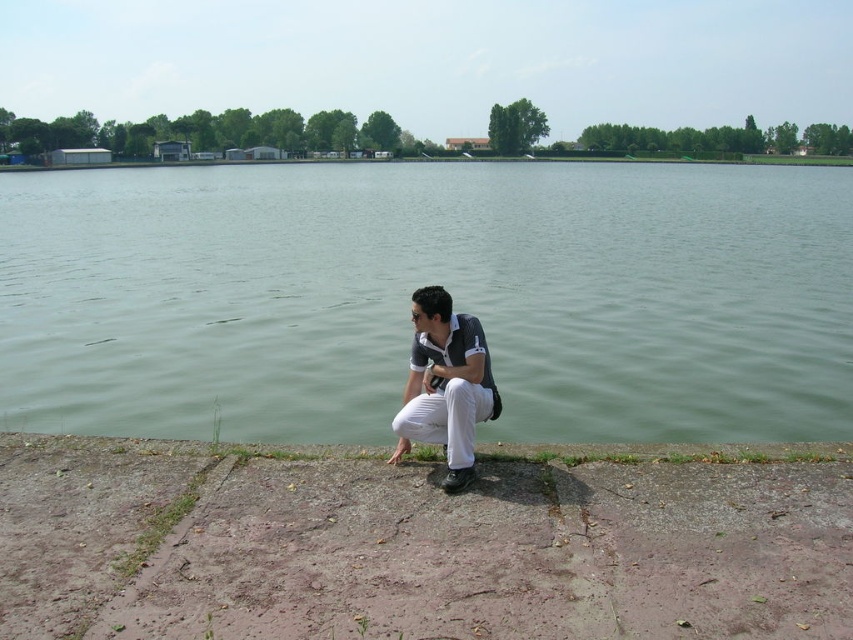
Is green water at lower center bigger than white cotton pants at lower center?

Yes.

Is point (115, 392) farther from camera compared to point (440, 483)?

Yes.

In order to click on green water at lower center in this screenshot , I will do `click(425, 284)`.

Is white cotton pants at lower center bigger than gray concrete curb at lower center?

Correct, white cotton pants at lower center is larger in size than gray concrete curb at lower center.

Is the position of white cotton pants at lower center less distant than that of gray concrete curb at lower center?

Yes, it is.

Where is `white cotton pants at lower center`? This screenshot has width=853, height=640. white cotton pants at lower center is located at coordinates (445, 385).

Can you confirm if green water at lower center is taller than gray concrete curb at lower center?

Yes.

Does green water at lower center appear on the right side of gray concrete curb at lower center?

Correct, you'll find green water at lower center to the right of gray concrete curb at lower center.

Image resolution: width=853 pixels, height=640 pixels. What are the coordinates of `green water at lower center` in the screenshot? It's located at (425, 284).